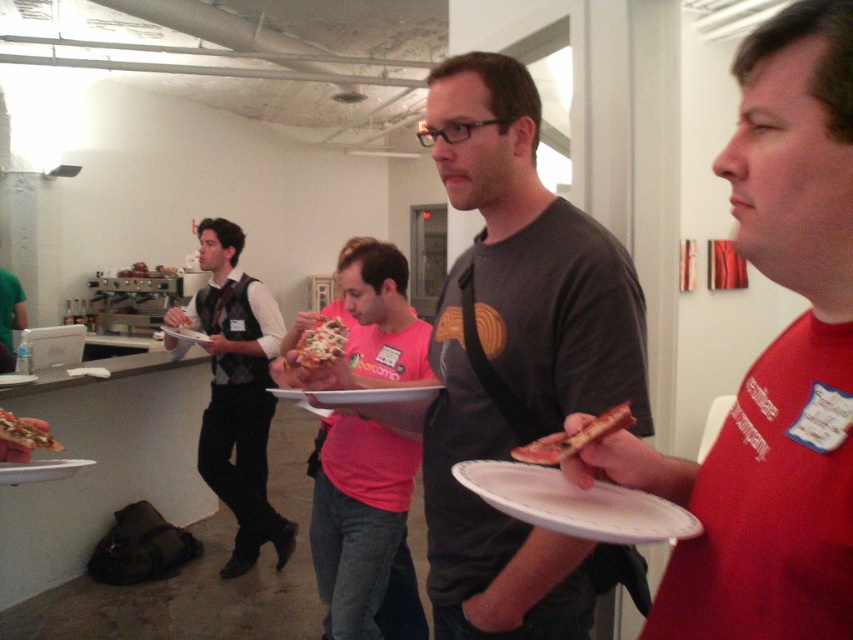
The image size is (853, 640). Describe the element at coordinates (573, 436) in the screenshot. I see `slightly charred crust at right` at that location.

Does slightly charred crust at right have a smaller size compared to cheesy pizza slice at center?

Yes.

Between point (585, 426) and point (297, 362), which one is positioned behind?

Point (297, 362)

Locate an element on the screen. This screenshot has width=853, height=640. slightly charred crust at right is located at coordinates (573, 436).

Can you confirm if white matte plate at center is smaller than cheesy pizza slice at center?

Actually, white matte plate at center might be larger than cheesy pizza slice at center.

You are a GUI agent. You are given a task and a screenshot of the screen. Output one action in this format:
    pyautogui.click(x=<x>, y=<y>)
    Task: Click on the white matte plate at center
    The image size is (853, 640).
    Given the screenshot: What is the action you would take?
    pyautogui.click(x=358, y=396)

Can you confirm if white matte plate at center is taller than golden brown crusty pizza at lower left?

No.

Who is positioned more to the left, white matte plate at center or golden brown crusty pizza at lower left?

golden brown crusty pizza at lower left is more to the left.

Does point (430, 385) come behind point (47, 445)?

That is True.

Locate an element on the screen. Image resolution: width=853 pixels, height=640 pixels. white matte plate at center is located at coordinates click(x=358, y=396).